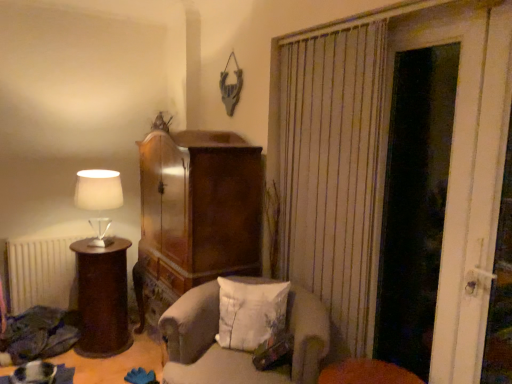
I want to click on empty space that is ontop of white wooden door at right (from a real-world perspective), so click(x=444, y=14).